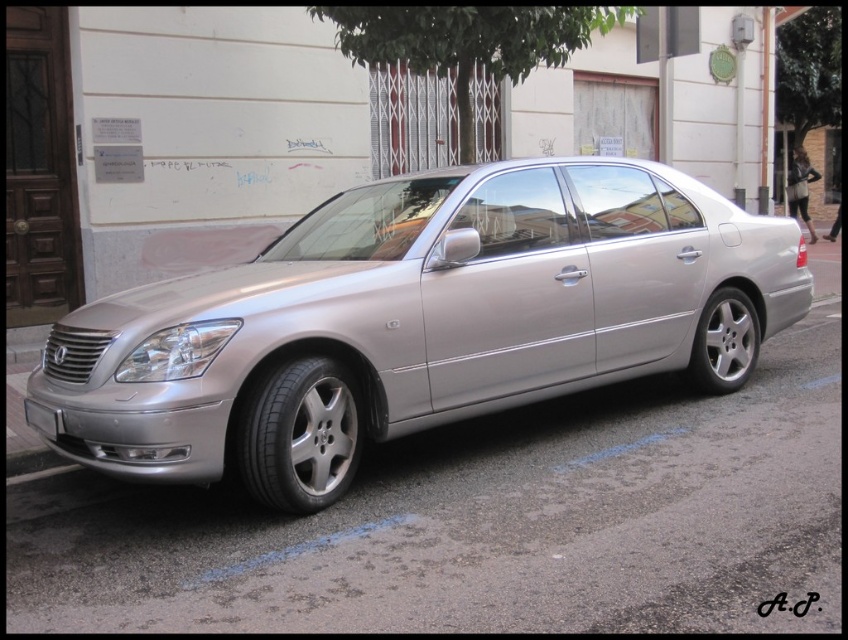
Is point (533, 266) positioned behind point (65, 461)?

No.

Is point (743, 376) positioned before point (20, 454)?

No, it is behind (20, 454).

At what (x,y) coordinates should I click in order to perform the action: click on silver metallic car at center. Please return your answer as a coordinate pair (x, y). The image size is (848, 640). Looking at the image, I should click on (417, 321).